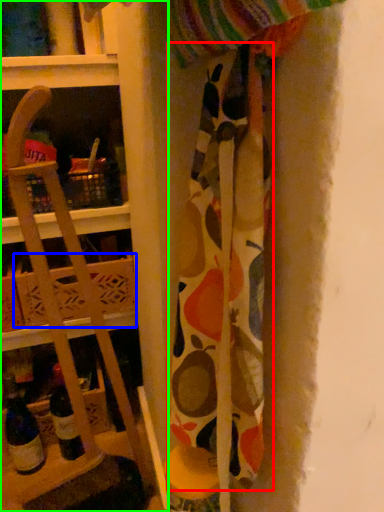
Question: Which object is positioned closest to fabric (highlighted by a red box)? Select from cardboard box (highlighted by a blue box) and shelf (highlighted by a green box).

Choices:
 (A) cardboard box
 (B) shelf

Answer: (B)